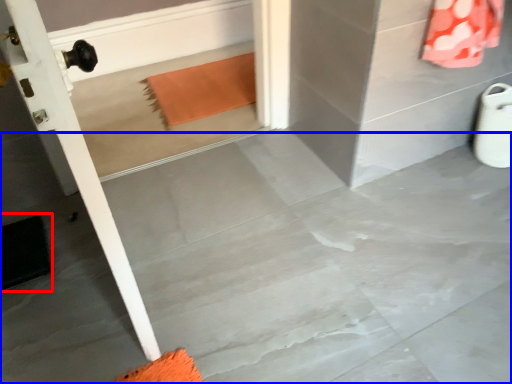
Question: Which of the following is the farthest to the observer, doormat (highlighted by a red box) or concrete (highlighted by a blue box)?

Choices:
 (A) doormat
 (B) concrete

Answer: (A)